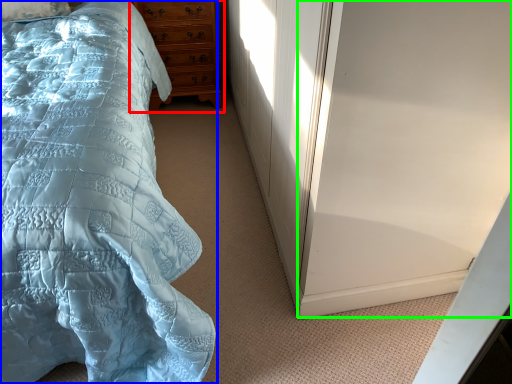
Question: Estimate the real-world distances between objects in this image. Which object is farther from chest of drawers (highlighted by a red box), bed (highlighted by a blue box) or screen door (highlighted by a green box)?

Choices:
 (A) bed
 (B) screen door

Answer: (B)